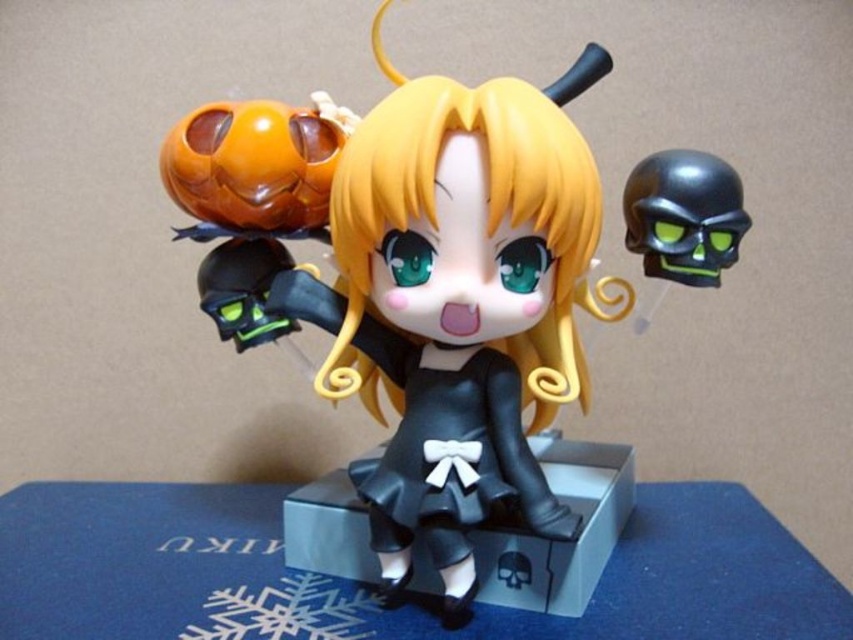
Question: Among these points, which one is farthest from the camera?

Choices:
 (A) (184, 141)
 (B) (680, 257)
 (C) (543, 433)
 (D) (677, 204)

Answer: (C)

Question: Which object is positioned farthest from the glossy black skull at upper right?

Choices:
 (A) black matte box at center
 (B) black matte skull at upper right
 (C) matte black figure at center
 (D) orange matte pumpkin at upper left

Answer: (D)

Question: Does orange matte pumpkin at upper left appear over black matte box at center?

Choices:
 (A) yes
 (B) no

Answer: (A)

Question: Does matte black figure at center appear on the left side of orange matte pumpkin at upper left?

Choices:
 (A) no
 (B) yes

Answer: (A)

Question: Can you confirm if orange matte pumpkin at upper left is smaller than glossy black skull at upper right?

Choices:
 (A) no
 (B) yes

Answer: (A)

Question: Which of the following is the closest to the observer?

Choices:
 (A) (637, 234)
 (B) (573, 593)
 (C) (201, 262)

Answer: (B)